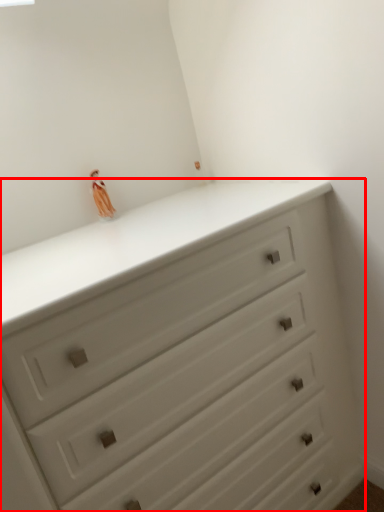
Question: From the image's perspective, where is chest of drawers (annotated by the red box) located relative to miniature?

Choices:
 (A) below
 (B) above

Answer: (A)